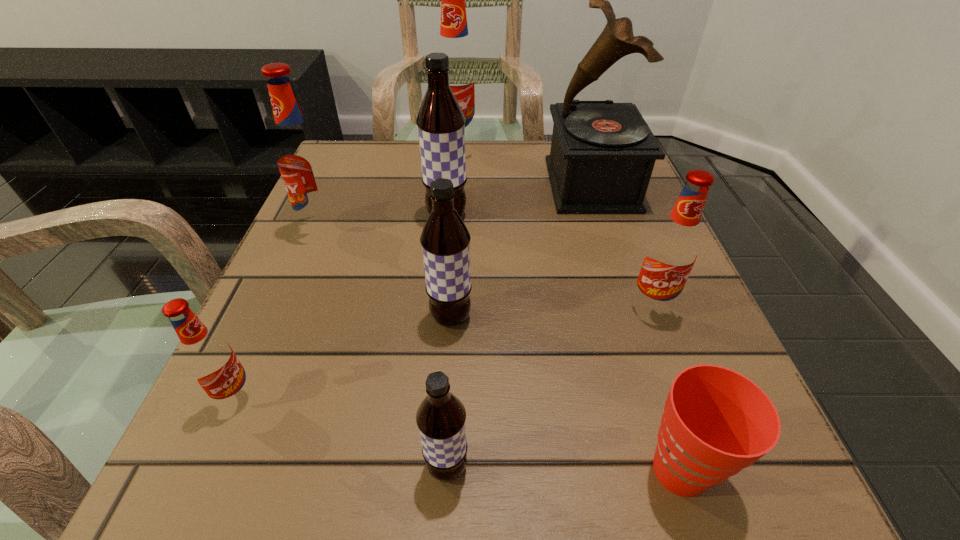
This screenshot has height=540, width=960. What are the coordinates of `cup located in the right edge section of the desktop` in the screenshot? It's located at (716, 422).

The width and height of the screenshot is (960, 540). What are the coordinates of `object that is positioned at the far right corner` in the screenshot? It's located at (602, 155).

Identify the location of object that is at the near right corner. (716, 422).

This screenshot has height=540, width=960. I want to click on free space at the far edge of the desktop, so [515, 177].

Image resolution: width=960 pixels, height=540 pixels. Identify the location of vacant space at the near edge. (396, 514).

Locate an element on the screen. Image resolution: width=960 pixels, height=540 pixels. free location at the left edge is located at coordinates (359, 212).

The image size is (960, 540). I want to click on free spot at the right edge of the desktop, so (x=661, y=222).

This screenshot has height=540, width=960. Find the location of `free space at the far left corner`. free space at the far left corner is located at coordinates (379, 189).

Locate an element on the screen. This screenshot has width=960, height=540. vacant area that lies between the third nearest red root beer and the nearest red root beer is located at coordinates (280, 313).

Locate an element on the screen. free space between the biggest red root beer and the cup is located at coordinates (569, 311).